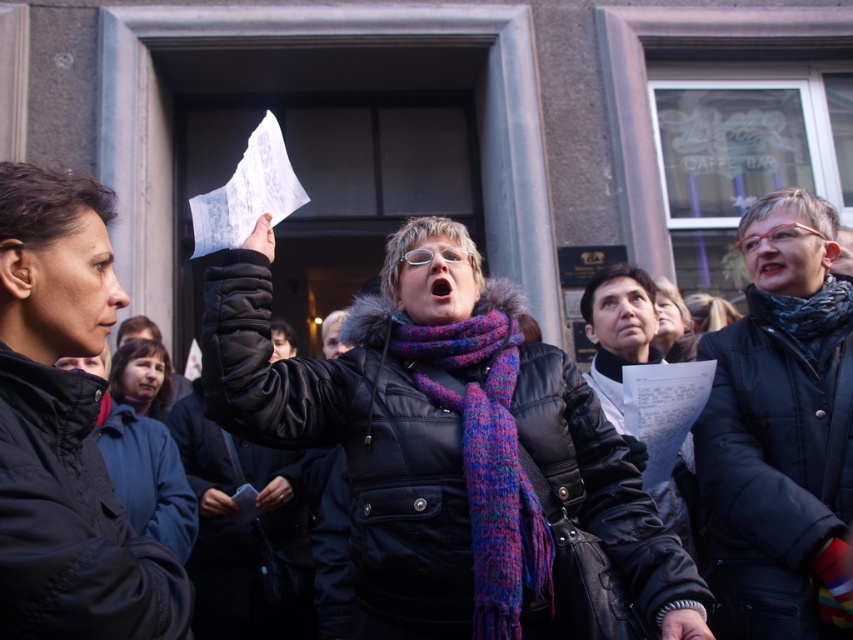
Question: Is the position of black matte jacket at upper right less distant than that of matte blue scarf at lower left?

Choices:
 (A) no
 (B) yes

Answer: (B)

Question: Which of these objects is positioned farthest from the matte black jacket at left?

Choices:
 (A) matte blue scarf at lower left
 (B) purple knitted scarf at center
 (C) matte black jacket at center
 (D) black matte jacket at upper right

Answer: (D)

Question: Does purple knitted scarf at center have a greater width compared to matte black jacket at left?

Choices:
 (A) yes
 (B) no

Answer: (A)

Question: Which point is farther to the camera?

Choices:
 (A) (502, 436)
 (B) (62, 420)

Answer: (A)

Question: Can you confirm if matte black jacket at left is smaller than black matte jacket at upper right?

Choices:
 (A) yes
 (B) no

Answer: (A)

Question: Among these points, which one is farthest from the camera?

Choices:
 (A) (138, 380)
 (B) (491, 449)
 (C) (500, 362)

Answer: (A)